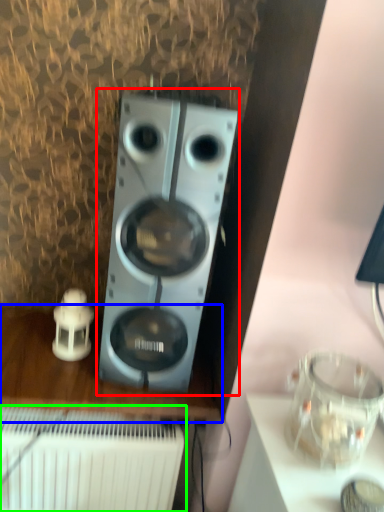
Question: Which is farther away from home appliance (highlighted by a red box)? furniture (highlighted by a blue box) or radiator (highlighted by a green box)?

Choices:
 (A) furniture
 (B) radiator

Answer: (B)